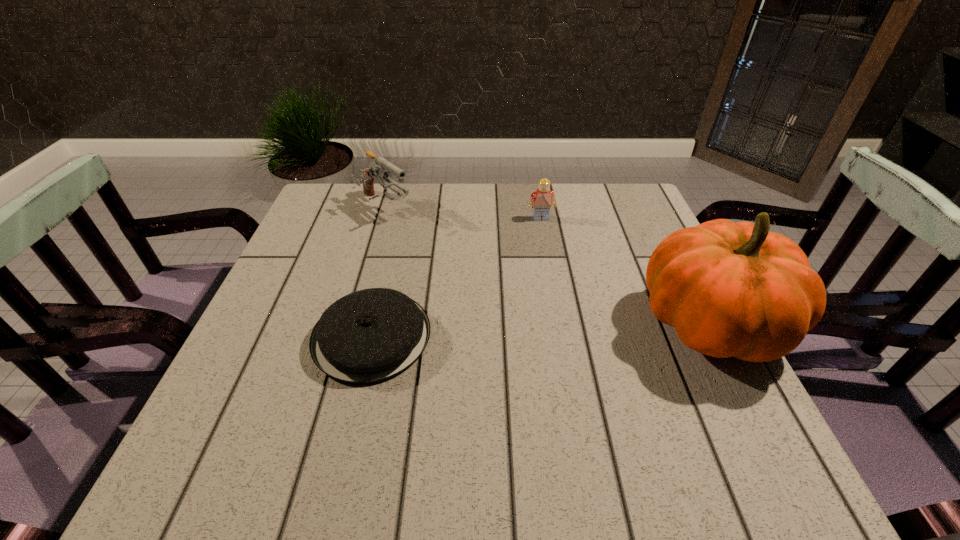
Locate an element on the screen. object that is at the right edge is located at coordinates (729, 289).

Find the location of `object at the far left corner`. object at the far left corner is located at coordinates (377, 169).

Find the location of a particular element. This screenshot has width=960, height=540. object situated at the near left corner is located at coordinates (368, 336).

Locate an element on the screen. The image size is (960, 540). object that is at the near right corner is located at coordinates (729, 289).

Find the location of a particular element. free space at the far edge is located at coordinates (401, 214).

This screenshot has width=960, height=540. I want to click on free space at the near edge of the desktop, so click(x=361, y=399).

Locate an element on the screen. free space at the left edge of the desktop is located at coordinates (342, 250).

This screenshot has width=960, height=540. Find the location of `vacant space at the right edge of the desktop`. vacant space at the right edge of the desktop is located at coordinates (613, 282).

Locate an element on the screen. This screenshot has height=540, width=960. blank space at the far left corner is located at coordinates (339, 206).

In the image, there is a desktop. Identify the location of free space at the near left corner. (249, 392).